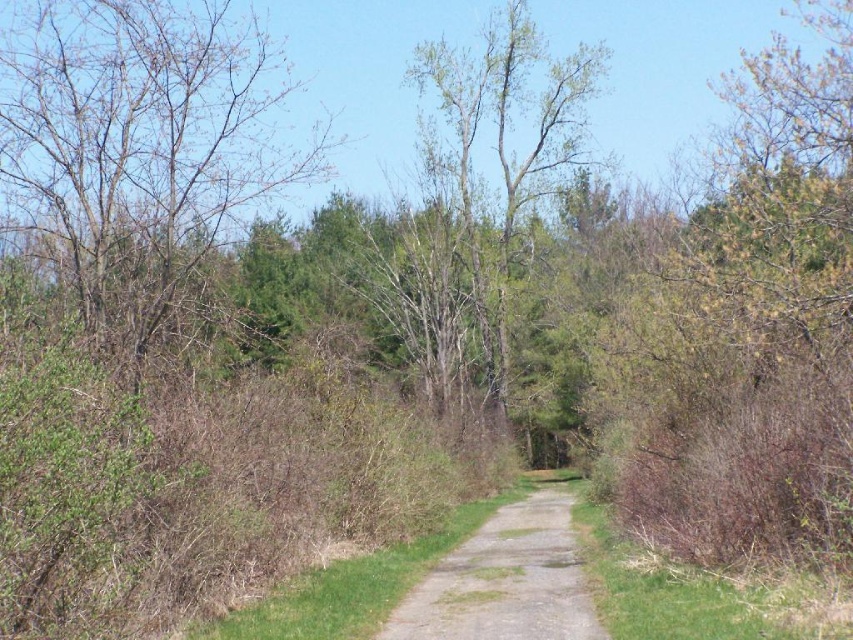
You are standing at the starting point of the path in the forest and see two points marked on the ground ahead of you. The first point is at coordinates point (543, 164) and the second is at point (461, 616). If you were to walk along the path towards the direction it curves, which point would you encounter first?

You would encounter point (461, 616) first because it is in front of point (543, 164) along the path.

You are a hiker standing on the dull gray gravel path at center and looking towards the bare branches at left. Which object is higher in elevation?

The bare branches at left are higher in elevation than the dull gray gravel path at center because they are positioned above it.

You are a hiker trying to follow the gravel path through the forest. You notice the bare branches at left and the dull gray gravel path at center. Which of these two objects is wider?

The bare branches at left are wider than the dull gray gravel path at center.